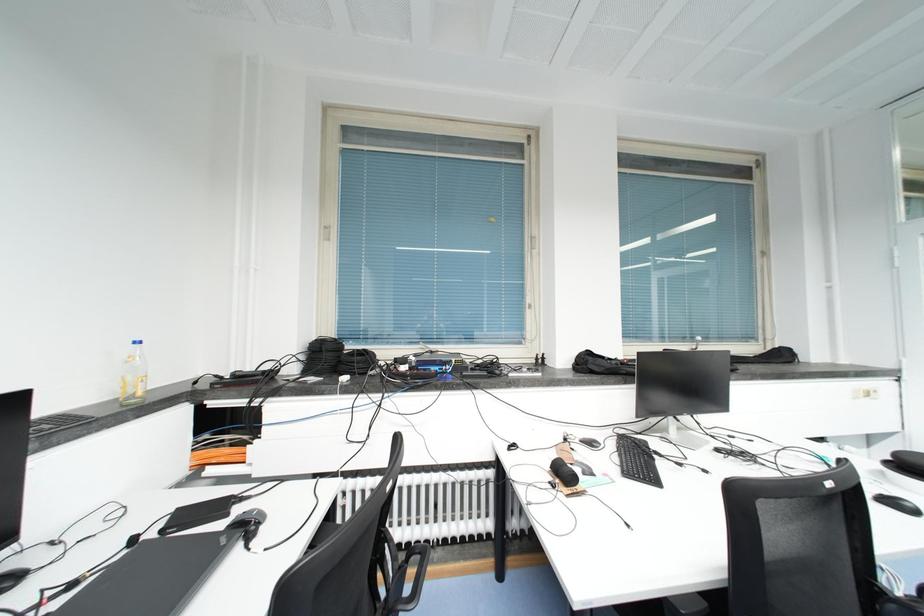
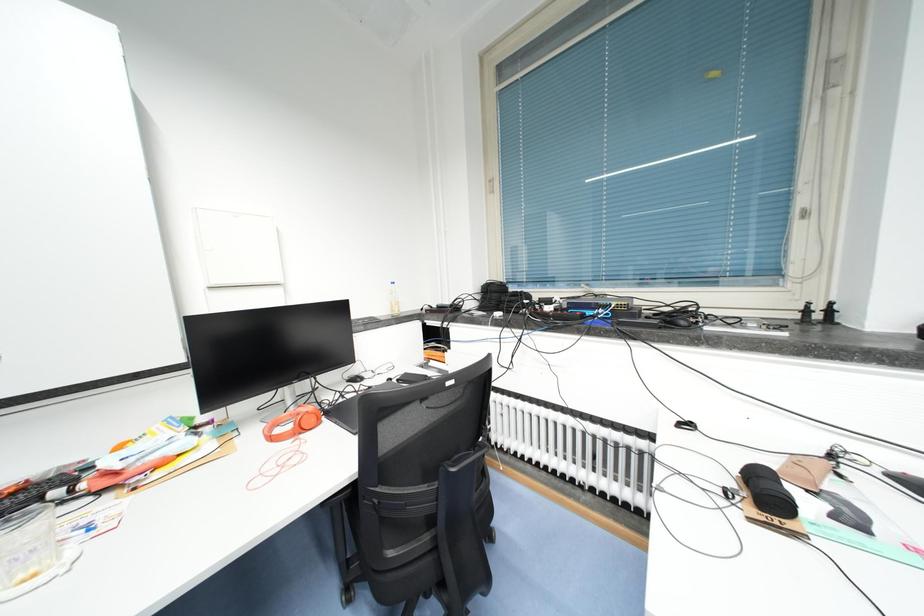
Question: The first image is from the beginning of the video and the second image is from the end. How did the camera likely rotate when shooting the video?

Choices:
 (A) Left
 (B) Right
 (C) Up
 (D) Down

Answer: (A)